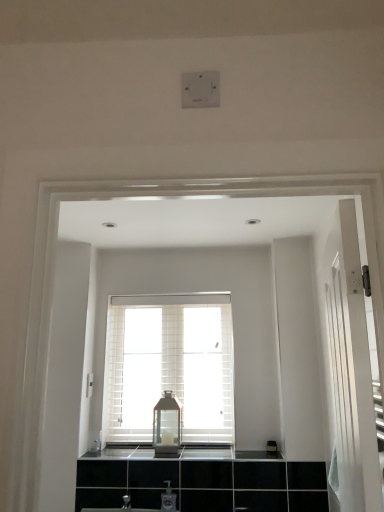
This screenshot has height=512, width=384. What are the coordinates of `matte glass lantern at center` in the screenshot? It's located at (x=167, y=426).

Measure the distance between point (129,451) and camera.

The distance of point (129,451) from camera is 8.66 feet.

What are the coordinates of `matte glass lantern at center` in the screenshot? It's located at pos(167,426).

Looking at their sizes, would you say matte glass lantern at center is wider or thinner than black glossy countertop at center?

Considering their sizes, matte glass lantern at center looks slimmer than black glossy countertop at center.

How many degrees apart are the facing directions of matte glass lantern at center and black glossy countertop at center?

→ There is a 0.733-degree angle between the facing directions of matte glass lantern at center and black glossy countertop at center.

Looking at this image, is matte glass lantern at center positioned far away from black glossy countertop at center?

matte glass lantern at center is near black glossy countertop at center, not far away.

Considering the positions of objects black glossy countertop at center and white textured window at center in the image provided, who is in front, black glossy countertop at center or white textured window at center?

black glossy countertop at center is in front.

Does black glossy countertop at center contain white textured window at center?

Actually, white textured window at center is outside black glossy countertop at center.

Is black glossy countertop at center far from white textured window at center?

No, black glossy countertop at center is not far away from white textured window at center.

From the image's perspective, which is above, black glossy countertop at center or white textured window at center?

white textured window at center.

Which point is more distant from viewer, (165, 507) or (198, 333)?

The point (198, 333) is more distant.

From the image's perspective, is clear plastic soap dispenser at lower center positioned above or below white textured window at center?

Clearly, from the image's perspective, clear plastic soap dispenser at lower center is below white textured window at center.

From a real-world perspective, who is located higher, clear plastic soap dispenser at lower center or white textured window at center?

white textured window at center.

Looking at the image, does clear plastic soap dispenser at lower center seem bigger or smaller compared to white textured window at center?

clear plastic soap dispenser at lower center is smaller than white textured window at center.

Is there a large distance between white textured window at center and matte glass lantern at center?

No, white textured window at center is not far from matte glass lantern at center.

Which object is positioned more to the right, white textured window at center or matte glass lantern at center?

Positioned to the right is white textured window at center.

Is white textured window at center looking in the opposite direction of matte glass lantern at center?

Yes, matte glass lantern at center is at the back of white textured window at center.

Is matte glass lantern at center surrounded by white textured window at center?

No, white textured window at center does not contain matte glass lantern at center.

How different are the orientations of white textured window at center and black glossy countertop at center in degrees?

The angular difference between white textured window at center and black glossy countertop at center is 0.0892 degrees.

Is white textured window at center not close to black glossy countertop at center?

That's not correct — white textured window at center is a little close to black glossy countertop at center.

Is white textured window at center located outside black glossy countertop at center?

Yes, white textured window at center is located beyond the bounds of black glossy countertop at center.

At what (x,y) coordinates should I click in order to perform the action: click on window above the black glossy countertop at center (from a real-world perspective). Please return your answer as a coordinate pair (x, y). Looking at the image, I should click on (169, 366).

Is clear plastic soap dispenser at lower center aimed at matte glass lantern at center?

No, clear plastic soap dispenser at lower center is not oriented towards matte glass lantern at center.

Is point (164, 497) positioned in front of point (168, 426)?

Yes.

From a real-world perspective, is clear plastic soap dispenser at lower center beneath matte glass lantern at center?

Yes, from a real-world perspective, clear plastic soap dispenser at lower center is below matte glass lantern at center.

Considering the positions of point (211, 438) and point (164, 499), is point (211, 438) closer or farther from the camera than point (164, 499)?

Point (211, 438) appears to be farther away from the viewer than point (164, 499).

From the image's perspective, is white textured window at center positioned above or below clear plastic soap dispenser at lower center?

From the image's perspective, white textured window at center appears above clear plastic soap dispenser at lower center.

Can you confirm if white textured window at center is positioned to the right of clear plastic soap dispenser at lower center?

Incorrect, white textured window at center is not on the right side of clear plastic soap dispenser at lower center.

Identify the location of counter top to the right of matte glass lantern at center. This screenshot has width=384, height=512. (227, 453).

Identify the location of window above the black glossy countertop at center (from the image's perspective). This screenshot has height=512, width=384. (169, 366).

Considering their positions, is matte glass lantern at center positioned closer to clear plastic soap dispenser at lower center than black glossy countertop at center?

matte glass lantern at center is positioned closer to the anchor clear plastic soap dispenser at lower center.

Estimate the real-world distances between objects in this image. Which object is further from clear plastic soap dispenser at lower center, white textured window at center or matte glass lantern at center?

white textured window at center lies further to clear plastic soap dispenser at lower center than the other object.

Estimate the real-world distances between objects in this image. Which object is further from clear plastic soap dispenser at lower center, white textured window at center or black glossy countertop at center?

white textured window at center is positioned further to the anchor clear plastic soap dispenser at lower center.

Considering their positions, is white textured window at center positioned further to matte glass lantern at center than black glossy countertop at center?

white textured window at center.

When comparing their distances from matte glass lantern at center, does clear plastic soap dispenser at lower center or black glossy countertop at center seem further?

clear plastic soap dispenser at lower center is further to matte glass lantern at center.

Looking at the image, which one is located closer to white textured window at center, black glossy countertop at center or clear plastic soap dispenser at lower center?

Among the two, black glossy countertop at center is located nearer to white textured window at center.

When comparing their distances from black glossy countertop at center, does white textured window at center or clear plastic soap dispenser at lower center seem further?

white textured window at center is further to black glossy countertop at center.

Based on their spatial positions, is black glossy countertop at center or matte glass lantern at center further from white textured window at center?

black glossy countertop at center lies further to white textured window at center than the other object.

Where is `medicine cabinet between white textured window at center and clear plastic soap dispenser at lower center vertically`? Image resolution: width=384 pixels, height=512 pixels. medicine cabinet between white textured window at center and clear plastic soap dispenser at lower center vertically is located at coordinates (167, 426).

Identify the location of counter top between matte glass lantern at center and clear plastic soap dispenser at lower center in the vertical direction. The height and width of the screenshot is (512, 384). (227, 453).

Where is `counter top that lies between white textured window at center and clear plastic soap dispenser at lower center from top to bottom`? This screenshot has height=512, width=384. counter top that lies between white textured window at center and clear plastic soap dispenser at lower center from top to bottom is located at coordinates (227, 453).

What are the coordinates of `medicine cabinet between white textured window at center and black glossy countertop at center in the up-down direction` in the screenshot? It's located at (167, 426).